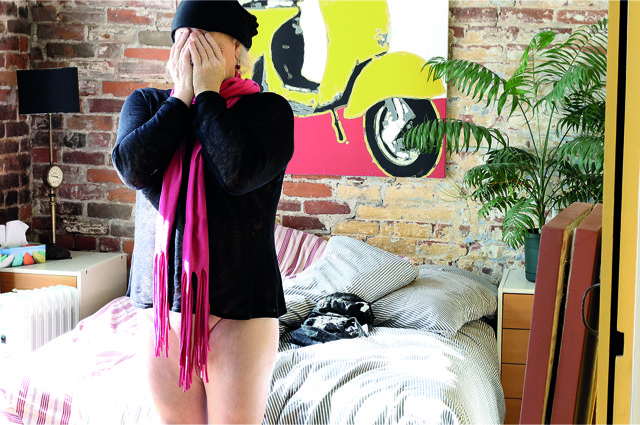
I want to click on nightstand, so click(513, 283), click(83, 261).